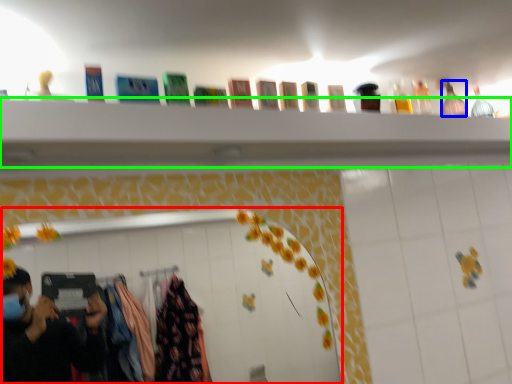
Question: Which object is the farthest from mirror (highlighted by a red box)? Choose among these: bottle (highlighted by a blue box) or closet (highlighted by a green box).

Choices:
 (A) bottle
 (B) closet

Answer: (A)